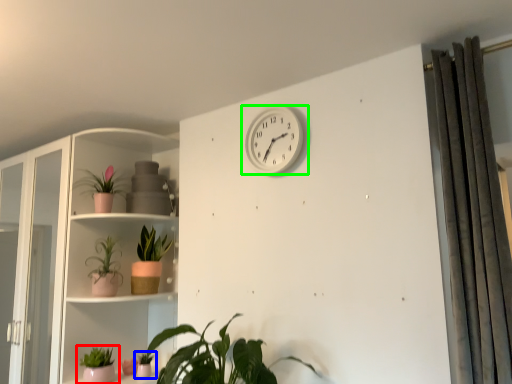
Question: Which object is positioned closest to houseplant (highlighted by a red box)? Select from houseplant (highlighted by a blue box) and wall clock (highlighted by a green box).

Choices:
 (A) houseplant
 (B) wall clock

Answer: (A)